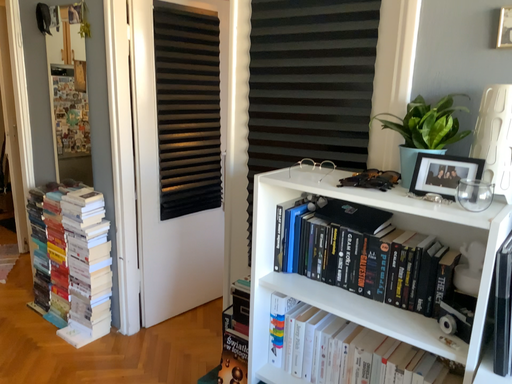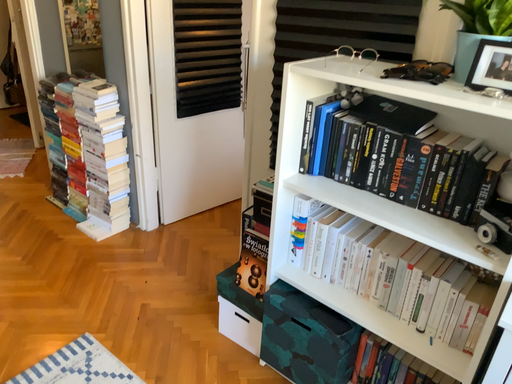
Question: How did the camera likely rotate when shooting the video?

Choices:
 (A) rotated upward
 (B) rotated downward

Answer: (B)